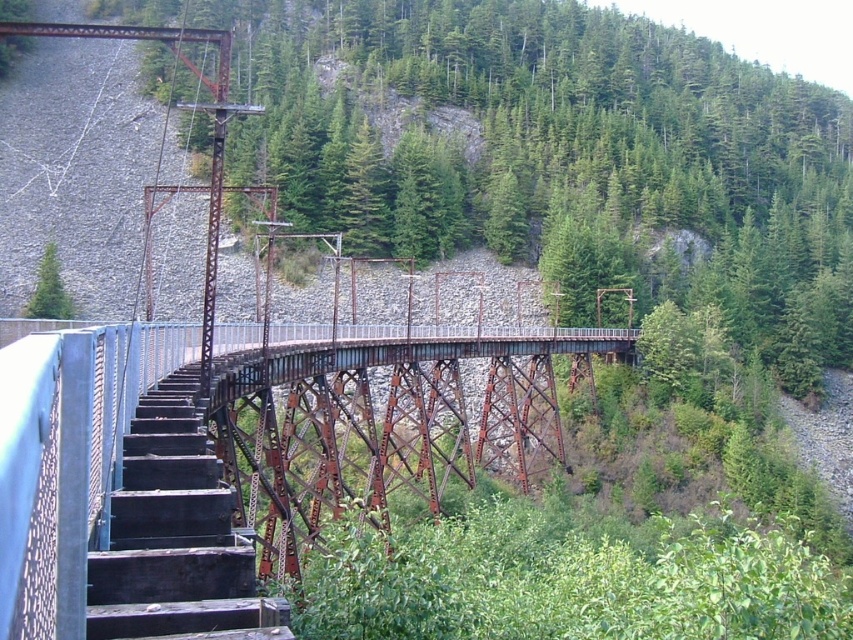
From the picture: You are a hiker carrying a large backpack and need to cross the rusty metal bridge at center. There is a green matte tree at upper left nearby. Which object is wider, the bridge or the tree?

The rusty metal bridge at center is wider than the green matte tree at upper left according to the description.

In the scene shown: You are a painter who wants to paint the rusty metal stairs at center and the green matte tree at upper left. If you use the same amount of paint for both, which object will require more paint? Please explain your reasoning based on their sizes.

The rusty metal stairs at center requires more paint because it is bigger than the green matte tree at upper left.

You are a delivery person carrying a large box that is 1.5 meters wide. You need to cross the bridge but must avoid the green matte tree at upper left. Can you safely walk through the rusty metal stairs at center without the box hitting the tree?

The rusty metal stairs at center are wider than the green matte tree at upper left, so the 1.5 meter wide box can pass safely as long as you stay centered on the stairs and avoid the narrower tree area.